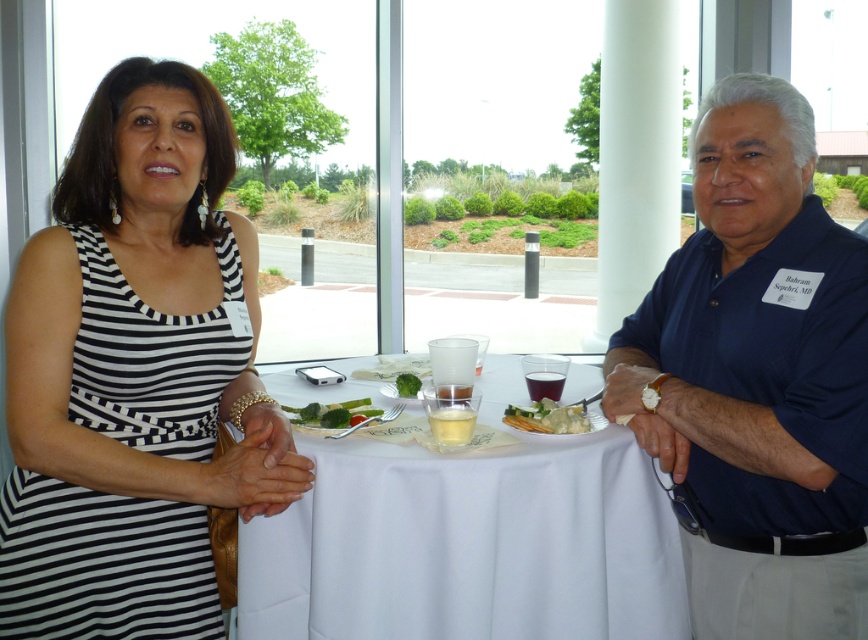
Question: Which point is closer to the camera?

Choices:
 (A) (722, 412)
 (B) (317, 387)

Answer: (A)

Question: Which of the following is the closest to the observer?

Choices:
 (A) (790, 221)
 (B) (406, 378)
 (C) (299, 412)
 (D) (584, 541)

Answer: (A)

Question: Does black striped dress at left appear over translucent glass plate at center?

Choices:
 (A) yes
 (B) no

Answer: (A)

Question: Is navy blue shirt at center thinner than translucent glass plate at center?

Choices:
 (A) yes
 (B) no

Answer: (A)

Question: In this image, where is navy blue shirt at center located relative to translucent glass plate at center?

Choices:
 (A) left
 (B) right

Answer: (B)

Question: Estimate the real-world distances between objects in this image. Which object is farther from the green leafy salad at center?

Choices:
 (A) white creamy sauce at center
 (B) green leafy vegetable at center

Answer: (A)